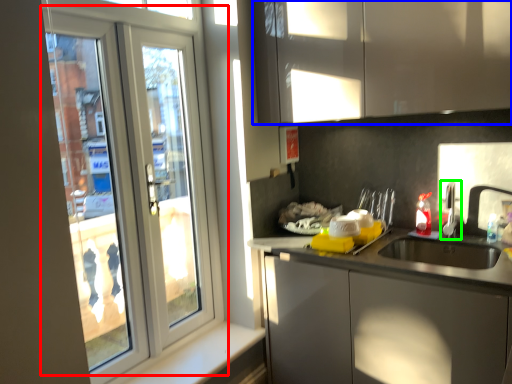
Question: Based on their relative distances, which object is farther from door (highlighted by a red box)? Choose from cabinetry (highlighted by a blue box) and tap (highlighted by a green box).

Choices:
 (A) cabinetry
 (B) tap

Answer: (B)